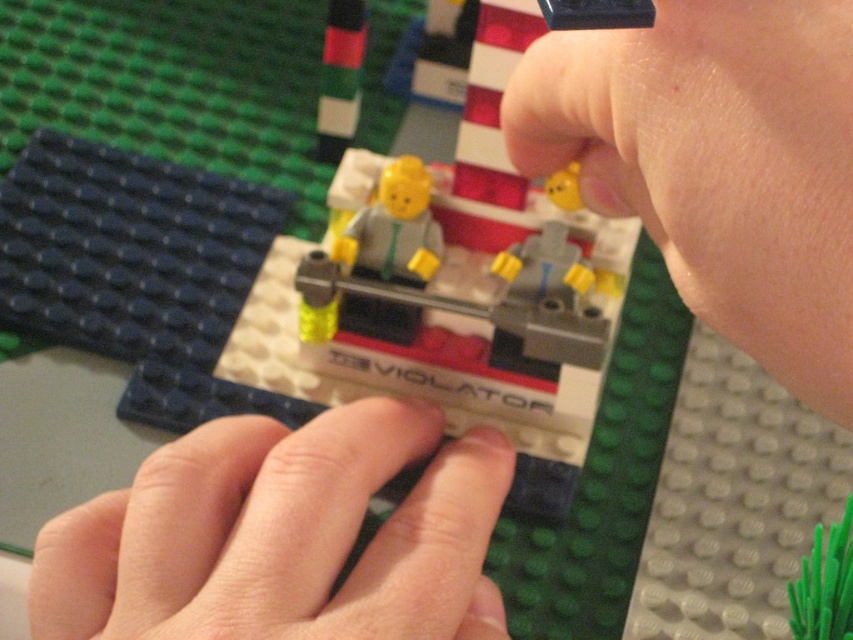
You are a child trying to place a sticker on the LEGO EVOLATOR. There are two areas labeled smooth skin at upper right and smooth skin at center. Which area should you choose to ensure the sticker adheres properly without overlapping?

The smooth skin at upper right is to the right of the smooth skin at center, so placing the sticker on the smooth skin at upper right would avoid overlapping with the one at center.

You are a LEGO collector examining the EVOLATOR vehicle. You notice two figures at the center. Which one is taller between the smooth skin at center and the matte gray figure at center?

The smooth skin at center is much taller than the matte gray figure at center.